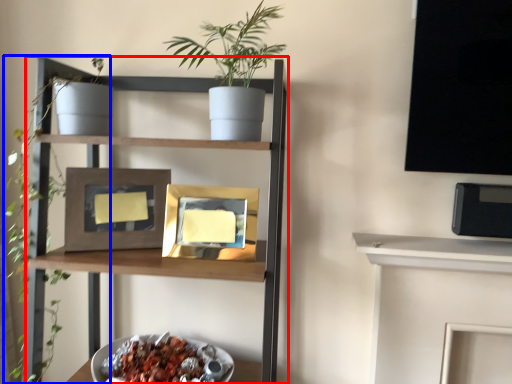
Question: Which point is further to the camera, shelf (highlighted by a red box) or plant (highlighted by a blue box)?

Choices:
 (A) shelf
 (B) plant

Answer: (B)